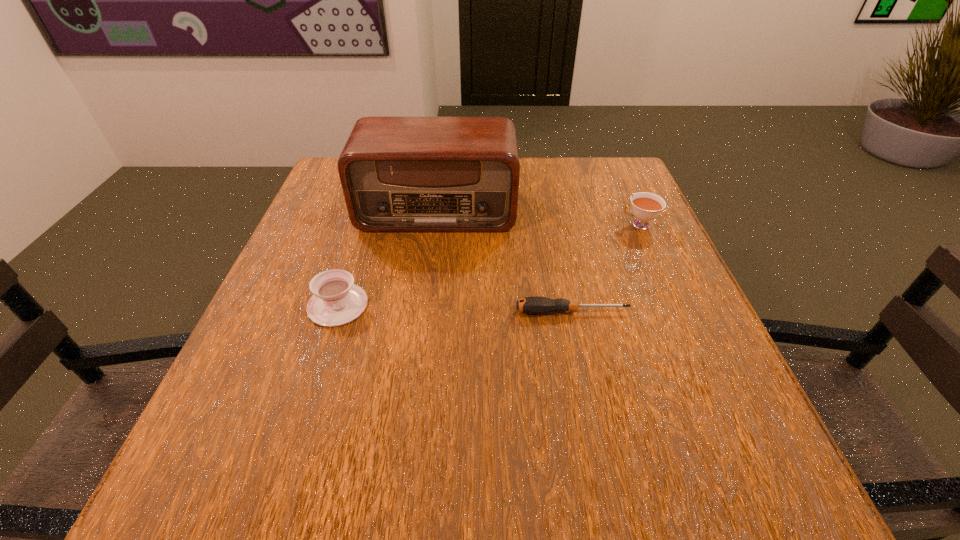
The image size is (960, 540). In order to click on free space that satisfies the following two spatial constraints: 1. on the handle side of the shortest object; 2. on the left side of the left teacup in this screenshot , I will do `click(336, 312)`.

You are a GUI agent. You are given a task and a screenshot of the screen. Output one action in this format:
    pyautogui.click(x=<x>, y=<y>)
    Task: Click on the vacant space that satisfies the following two spatial constraints: 1. on the front panel of the tallest object; 2. on the left side of the shortest object
    
    Given the screenshot: What is the action you would take?
    pyautogui.click(x=424, y=312)